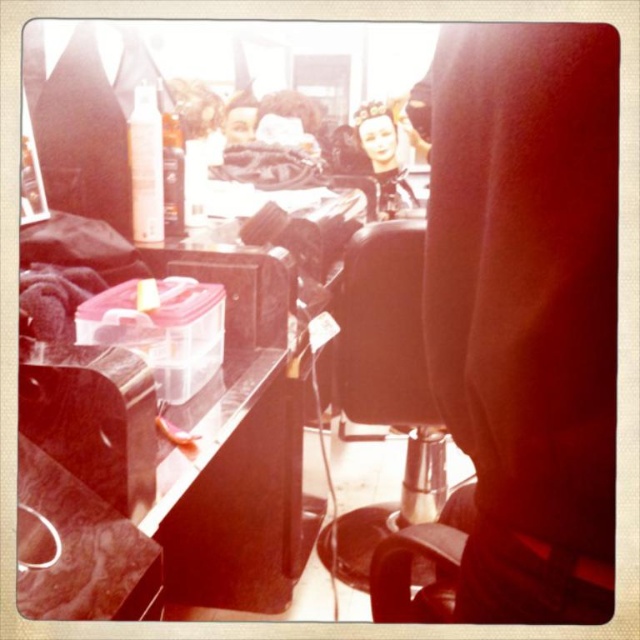
Question: Which of the following is the farthest from the observer?

Choices:
 (A) black leather swivel chair at center
 (B) smooth porcelain doll at center
 (C) blonde synthetic wig at center
 (D) black leather barber chair at center

Answer: (C)

Question: Is black leather barber chair at center positioned before smooth porcelain doll at center?

Choices:
 (A) yes
 (B) no

Answer: (A)

Question: Which of the following is the closest to the observer?

Choices:
 (A) smooth porcelain doll at center
 (B) black leather barber chair at center
 (C) black leather swivel chair at center

Answer: (B)

Question: Can you confirm if black leather swivel chair at center is wider than smooth porcelain doll at center?

Choices:
 (A) yes
 (B) no

Answer: (A)

Question: Does black leather barber chair at center lie behind smooth porcelain doll at center?

Choices:
 (A) no
 (B) yes

Answer: (A)

Question: Among these points, which one is farthest from the camera?

Choices:
 (A) (408, 138)
 (B) (448, 237)

Answer: (A)